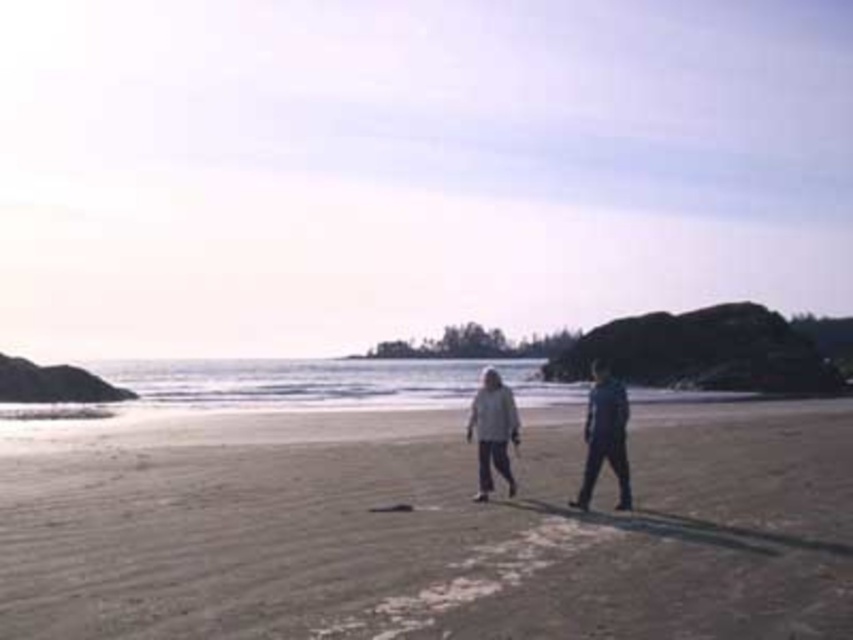
Question: Among these objects, which one is nearest to the camera?

Choices:
 (A) smooth sand at center
 (B) white fabric couple at center

Answer: (A)

Question: Can you confirm if white fabric couple at center is positioned to the left of light gray fabric pants at center?

Choices:
 (A) yes
 (B) no

Answer: (B)

Question: Which of the following is the farthest from the observer?

Choices:
 (A) light gray fabric pants at center
 (B) white fabric couple at center
 (C) dark blue fabric pants at right

Answer: (A)

Question: Which is nearer to the light gray fabric pants at center?

Choices:
 (A) white fabric couple at center
 (B) smooth sand at center
 (C) dark blue fabric pants at right

Answer: (A)

Question: Can you confirm if smooth sand at center is positioned to the left of dark blue fabric pants at right?

Choices:
 (A) yes
 (B) no

Answer: (A)

Question: Is dark blue fabric pants at right to the left of light gray fabric pants at center from the viewer's perspective?

Choices:
 (A) no
 (B) yes

Answer: (A)